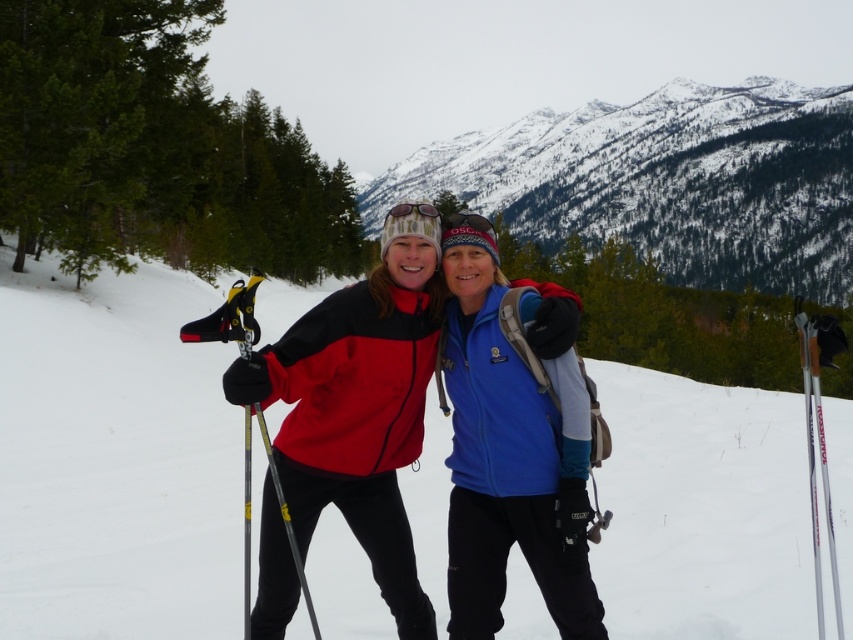
Question: Is silver metallic ski at right to the left of translucent plastic goggles at center from the viewer's perspective?

Choices:
 (A) no
 (B) yes

Answer: (A)

Question: Can you confirm if snowy mountain at center is wider than matte pink sunglasses at center?

Choices:
 (A) yes
 (B) no

Answer: (A)

Question: Which point appears closest to the camera in this image?

Choices:
 (A) (693, 419)
 (B) (817, 400)
 (C) (474, 216)

Answer: (B)

Question: Is white powder snow at center bigger than snowy mountain at center?

Choices:
 (A) no
 (B) yes

Answer: (A)

Question: Which point appears farthest from the camera in this image?

Choices:
 (A) (737, 445)
 (B) (404, 321)
 (C) (469, 198)

Answer: (C)

Question: Based on their relative distances, which object is nearer to the white powder snow at center?

Choices:
 (A) matte nylon jacket at center
 (B) silver metallic ski at right
 (C) snowy mountain at center
 (D) translucent plastic goggles at center

Answer: (A)